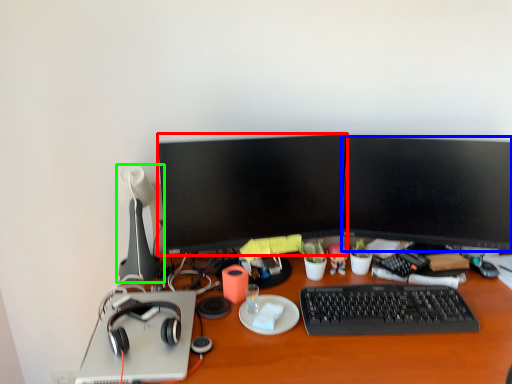
Question: Estimate the real-world distances between objects in this image. Which object is closer to television (highlighted by a red box), television (highlighted by a blue box) or lamp (highlighted by a green box)?

Choices:
 (A) television
 (B) lamp

Answer: (A)